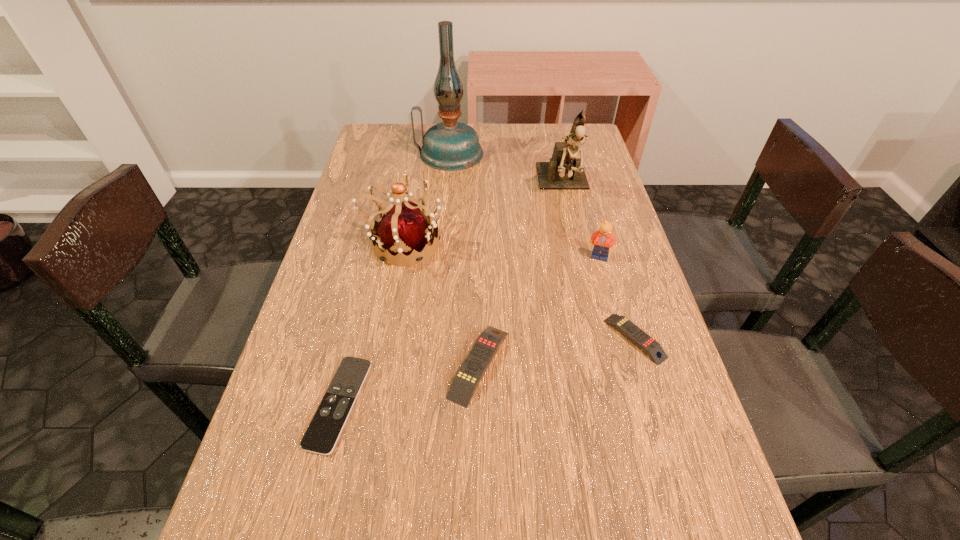
In order to click on the sixth tallest object in this screenshot , I will do `click(637, 336)`.

Identify the location of the shortest object. The width and height of the screenshot is (960, 540). (328, 422).

Locate an element on the screen. This screenshot has width=960, height=540. the shortest remote control is located at coordinates (328, 422).

The height and width of the screenshot is (540, 960). I want to click on vacant space positioned on the right of the tallest object, so click(x=597, y=153).

This screenshot has width=960, height=540. I want to click on vacant space located on the front-facing side of the sixth shortest object, so click(590, 303).

The image size is (960, 540). What are the coordinates of `vacant point located on the front-facing side of the tiara` in the screenshot? It's located at (584, 244).

You are a GUI agent. You are given a task and a screenshot of the screen. Output one action in this format:
    pyautogui.click(x=<x>, y=<y>)
    Task: Click on the vacant space located 0.150m on the front-facing side of the Lego
    This screenshot has height=540, width=960.
    Given the screenshot: What is the action you would take?
    pyautogui.click(x=613, y=309)

Locate an element on the screen. The image size is (960, 540). blank area located 0.080m on the left of the bigger yellow remote control is located at coordinates (408, 364).

Identify the location of vacant space located 0.140m on the back of the second shortest object. [x=613, y=269].

Where is `vacant space located on the back of the leftmost remote control`? vacant space located on the back of the leftmost remote control is located at coordinates (357, 327).